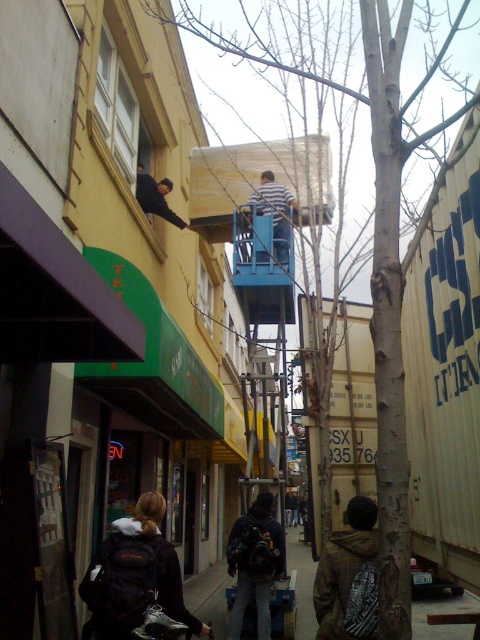
You are a delivery person carrying a 5.5 meter long package. You need to navigate through the alleyway between the two buildings. There is a black backpack at lower left and dark blue jeans at upper left. Can you safely pass through the alleyway without tilting the package?

The distance between the black backpack at lower left and the dark blue jeans at upper left is 5.15 meters. Since your package is 5.5 meters long, it is slightly longer than the available space. You cannot safely pass through the alleyway without tilting the package.

You are a delivery person who needs to place a large package on the concrete sidewalk at lower center. However, there is a dark blue backpack at center in the way. Can you lift the backpack to the side to make space?

The concrete sidewalk at lower center is much taller than the dark blue backpack at center, so you can lift the dark blue backpack at center to the side and place the package on the concrete sidewalk at lower center.